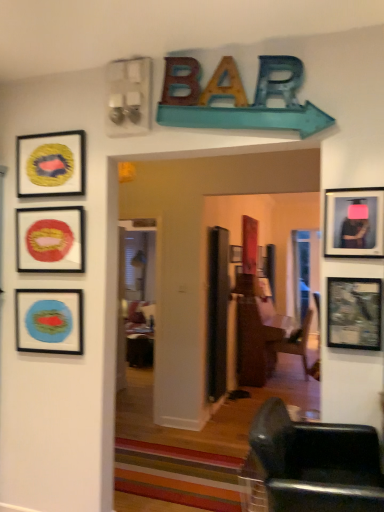
Question: Can you confirm if wooden striped rug at center is shorter than matte black picture frame at center, which is counted as the sixth picture frame, starting from the front?

Choices:
 (A) no
 (B) yes

Answer: (B)

Question: From the image's perspective, is wooden striped rug at center beneath matte black picture frame at center, which is the third picture frame from right to left?

Choices:
 (A) yes
 (B) no

Answer: (A)

Question: Are wooden striped rug at center and matte black picture frame at center, which is the third picture frame from right to left, located far from each other?

Choices:
 (A) no
 (B) yes

Answer: (B)

Question: Could you tell me if wooden striped rug at center is facing matte black picture frame at center, which appears as the fourth picture frame when viewed from the left?

Choices:
 (A) yes
 (B) no

Answer: (B)

Question: Considering the relative positions of wooden striped rug at center and matte black picture frame at center, which is counted as the first picture frame, starting from the back, in the image provided, is wooden striped rug at center in front of matte black picture frame at center, which is counted as the first picture frame, starting from the back,?

Choices:
 (A) no
 (B) yes

Answer: (B)

Question: From the image's perspective, is wooden striped rug at center located above or below matte black picture frame at center, which appears as the fourth picture frame when viewed from the left?

Choices:
 (A) below
 (B) above

Answer: (A)

Question: Relative to matte black picture frame at center, which appears as the fourth picture frame when viewed from the left, is wooden striped rug at center in front or behind?

Choices:
 (A) behind
 (B) front

Answer: (B)

Question: Visually, is wooden striped rug at center positioned to the left or to the right of matte black picture frame at center, which is counted as the sixth picture frame, starting from the front?

Choices:
 (A) left
 (B) right

Answer: (A)

Question: From a real-world perspective, is wooden striped rug at center above or below matte black picture frame at center, which is the third picture frame from right to left?

Choices:
 (A) below
 (B) above

Answer: (A)

Question: Is matte blue picture frame at left, which appears as the third picture frame when viewed from the back, inside or outside of brown wooden door at center?

Choices:
 (A) outside
 (B) inside

Answer: (A)

Question: Considering their positions, is matte blue picture frame at left, arranged as the first picture frame when viewed from the left, located in front of or behind brown wooden door at center?

Choices:
 (A) front
 (B) behind

Answer: (A)

Question: In terms of width, does matte blue picture frame at left, positioned as the sixth picture frame in right-to-left order, look wider or thinner when compared to brown wooden door at center?

Choices:
 (A) wide
 (B) thin

Answer: (B)

Question: Is matte blue picture frame at left, which appears as the third picture frame when viewed from the back, to the left or to the right of brown wooden door at center in the image?

Choices:
 (A) right
 (B) left

Answer: (B)

Question: From the image's perspective, is wooden framed map at right, which ranks as the 2th picture frame in front-to-back order, positioned above or below metallic silver television at right, which is counted as the 6th picture frame, starting from the back?

Choices:
 (A) below
 (B) above

Answer: (A)

Question: Considering the positions of point (339, 287) and point (367, 236), is point (339, 287) closer or farther from the camera than point (367, 236)?

Choices:
 (A) closer
 (B) farther

Answer: (B)